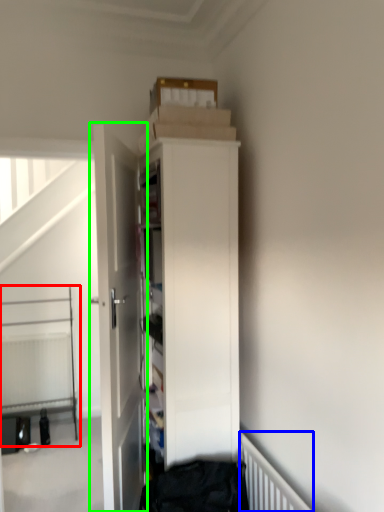
Question: Which object is positioned closest to bed (highlighted by a red box)? Select from radiator (highlighted by a blue box) and door (highlighted by a green box).

Choices:
 (A) radiator
 (B) door

Answer: (B)